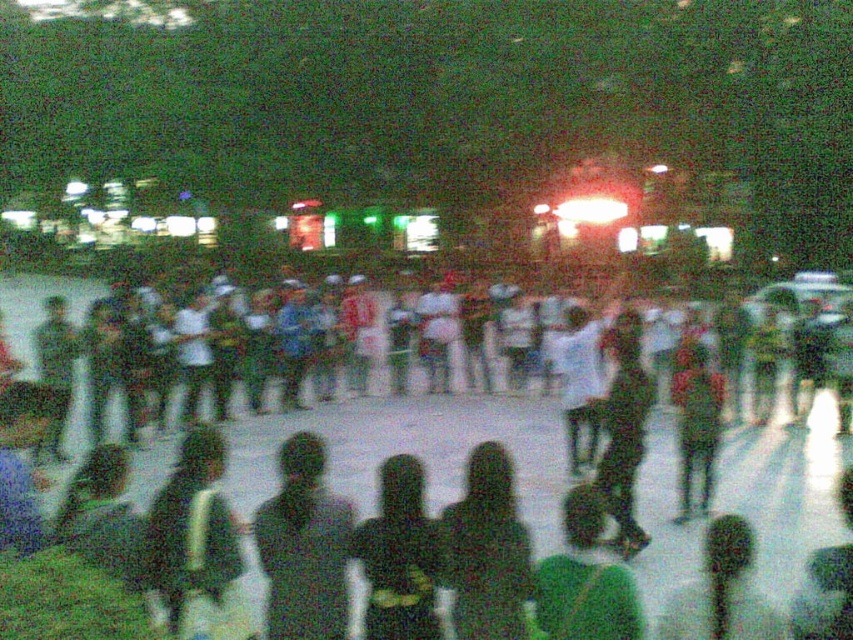
From the picture: You are a photographer trying to capture a clear shot of the dark green fabric jacket at center and the green fabric umbrella at lower right. Given that the camera can only focus on objects wider than 20 cm, will both objects be in focus?

The dark green fabric jacket at center has a larger width than the green fabric umbrella at lower right. Since the jacket is wider than the umbrella, and the camera focuses on objects wider than 20 cm, the jacket will be in focus. However, the umbrella might not be if its width is under 20 cm. But since the jacket is wider, it meets the requirement.